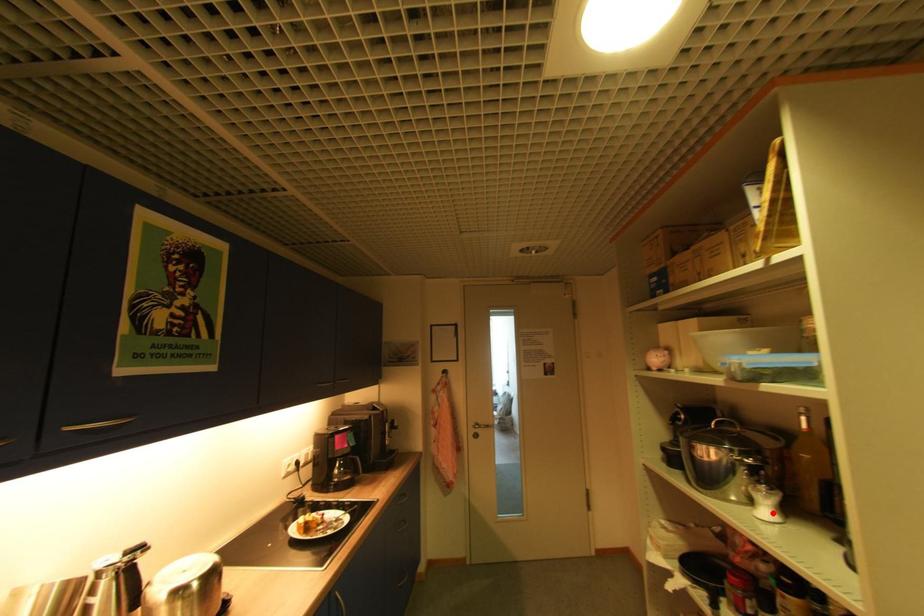
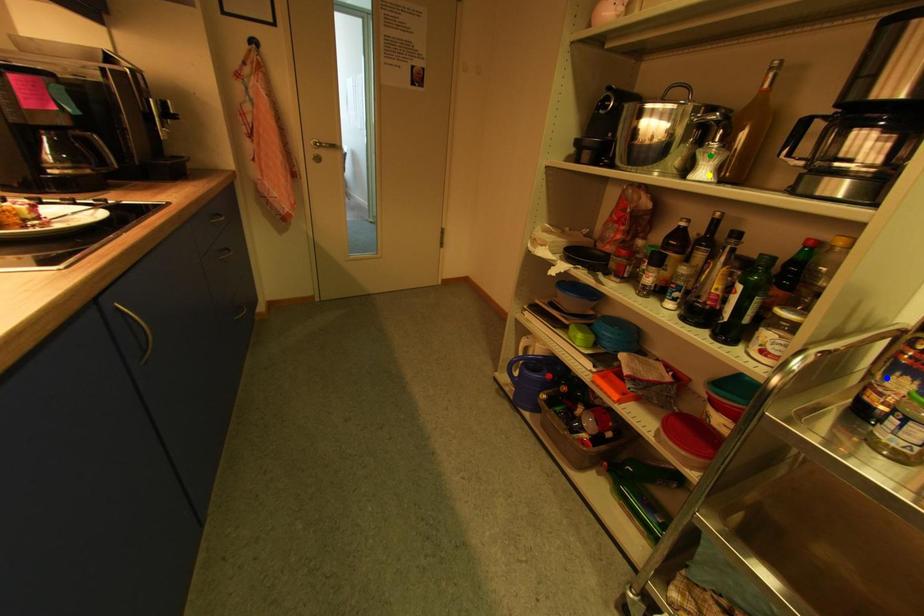
Question: I am providing you with two images of the same scene from different viewpoints. A red point is marked on the first image. You are given multiple points on the second image. Which point in image 2 is actually the same real-world point as the red point in image 1?

Choices:
 (A) blue point
 (B) yellow point
 (C) green point

Answer: (B)